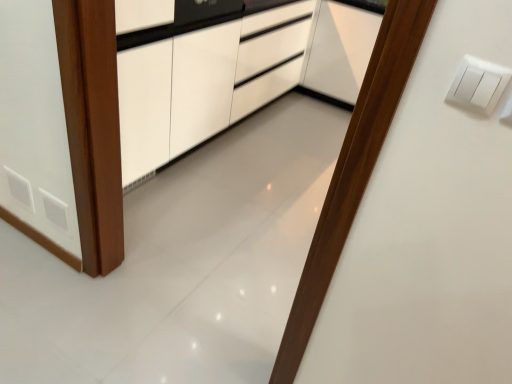
Question: Is white glossy cabinet at center at the right side of white plastic light switch at upper right?

Choices:
 (A) yes
 (B) no

Answer: (B)

Question: From a real-world perspective, is white glossy cabinet at center positioned under white plastic light switch at upper right based on gravity?

Choices:
 (A) yes
 (B) no

Answer: (A)

Question: Is the surface of white glossy cabinet at center in direct contact with white plastic light switch at upper right?

Choices:
 (A) yes
 (B) no

Answer: (B)

Question: Could you tell me if white glossy cabinet at center is turned towards white plastic light switch at upper right?

Choices:
 (A) yes
 (B) no

Answer: (B)

Question: Is white glossy cabinet at center turned away from white plastic light switch at upper right?

Choices:
 (A) no
 (B) yes

Answer: (A)

Question: Is white glossy cabinet at center outside white plastic light switch at upper right?

Choices:
 (A) yes
 (B) no

Answer: (A)

Question: Is the depth of white plastic light switch at upper right greater than that of white glossy cabinet at center?

Choices:
 (A) no
 (B) yes

Answer: (A)

Question: Considering the relative sizes of white plastic light switch at upper right and white glossy cabinet at center in the image provided, is white plastic light switch at upper right thinner than white glossy cabinet at center?

Choices:
 (A) yes
 (B) no

Answer: (A)

Question: Is white plastic light switch at upper right wider than white glossy cabinet at center?

Choices:
 (A) yes
 (B) no

Answer: (B)

Question: Is white plastic light switch at upper right outside white glossy cabinet at center?

Choices:
 (A) yes
 (B) no

Answer: (A)

Question: Is white plastic light switch at upper right facing away from white glossy cabinet at center?

Choices:
 (A) yes
 (B) no

Answer: (B)

Question: Does white plastic light switch at upper right have a larger size compared to white glossy cabinet at center?

Choices:
 (A) no
 (B) yes

Answer: (A)

Question: From the image's perspective, is white glossy cabinet at center above or below white plastic light switch at upper right?

Choices:
 (A) above
 (B) below

Answer: (A)